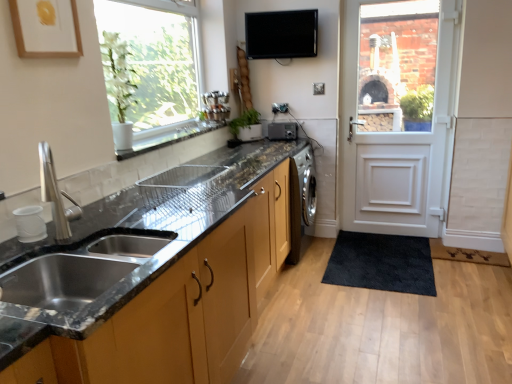
Question: Is white ceramic window sill at upper center at the left side of white wooden door at right?

Choices:
 (A) yes
 (B) no

Answer: (A)

Question: Is white ceramic window sill at upper center wider than white wooden door at right?

Choices:
 (A) yes
 (B) no

Answer: (A)

Question: Could you tell me if white ceramic window sill at upper center is facing white wooden door at right?

Choices:
 (A) yes
 (B) no

Answer: (B)

Question: Would you say white wooden door at right is part of white ceramic window sill at upper center's contents?

Choices:
 (A) no
 (B) yes

Answer: (A)

Question: Is the position of white ceramic window sill at upper center more distant than that of white wooden door at right?

Choices:
 (A) no
 (B) yes

Answer: (A)

Question: Are white ceramic window sill at upper center and white wooden door at right located far from each other?

Choices:
 (A) yes
 (B) no

Answer: (A)

Question: Can you confirm if green matte plant at center is smaller than matte brown cabinets at lower left, which appears as the second cabinetry when viewed from the top?

Choices:
 (A) yes
 (B) no

Answer: (A)

Question: Can we say green matte plant at center lies outside matte brown cabinets at lower left, acting as the first cabinetry starting from the bottom?

Choices:
 (A) yes
 (B) no

Answer: (A)

Question: Does green matte plant at center come in front of matte brown cabinets at lower left, acting as the first cabinetry starting from the bottom?

Choices:
 (A) no
 (B) yes

Answer: (A)

Question: Considering the relative positions of green matte plant at center and matte brown cabinets at lower left, which appears as the second cabinetry when viewed from the top, in the image provided, is green matte plant at center to the right of matte brown cabinets at lower left, which appears as the second cabinetry when viewed from the top, from the viewer's perspective?

Choices:
 (A) no
 (B) yes

Answer: (B)

Question: Is green matte plant at center shorter than matte brown cabinets at lower left, acting as the first cabinetry starting from the bottom?

Choices:
 (A) no
 (B) yes

Answer: (B)

Question: From a real-world perspective, is green matte plant at center under matte brown cabinets at lower left, acting as the first cabinetry starting from the bottom?

Choices:
 (A) no
 (B) yes

Answer: (A)

Question: Is white ceramic window sill at upper center at the left side of green matte plant at center?

Choices:
 (A) yes
 (B) no

Answer: (A)